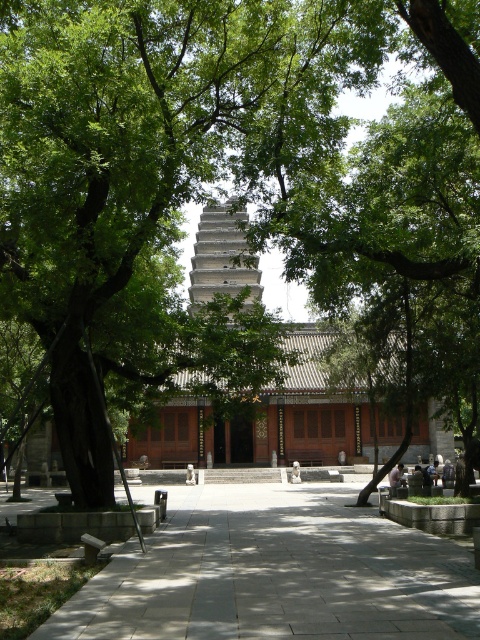
Question: Which point is farther from the camera taking this photo?

Choices:
 (A) (236, 544)
 (B) (392, 481)
 (C) (220, 252)

Answer: (C)

Question: Among these objects, which one is farthest from the camera?

Choices:
 (A) gray stone tower at center
 (B) gray stone pavement at center

Answer: (A)

Question: Does gray stone tower at center appear over light brown wooden bench at center?

Choices:
 (A) yes
 (B) no

Answer: (A)

Question: Which object is the closest to the light brown wooden bench at center?

Choices:
 (A) gray stone tower at center
 (B) gray stone pavement at center

Answer: (B)

Question: Does gray stone pavement at center lie in front of light brown wooden bench at center?

Choices:
 (A) yes
 (B) no

Answer: (A)

Question: Is gray stone tower at center positioned in front of light brown wooden bench at center?

Choices:
 (A) yes
 (B) no

Answer: (A)